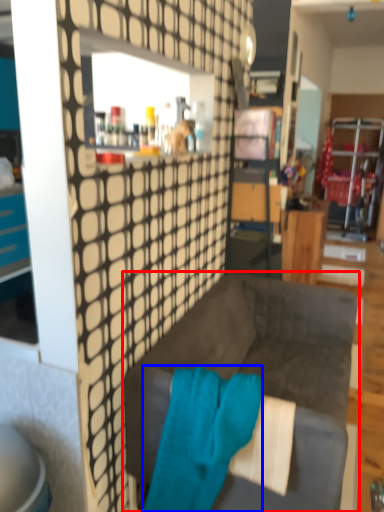
Question: Which object is further to the camera taking this photo, studio couch (highlighted by a red box) or bath towel (highlighted by a blue box)?

Choices:
 (A) studio couch
 (B) bath towel

Answer: (A)